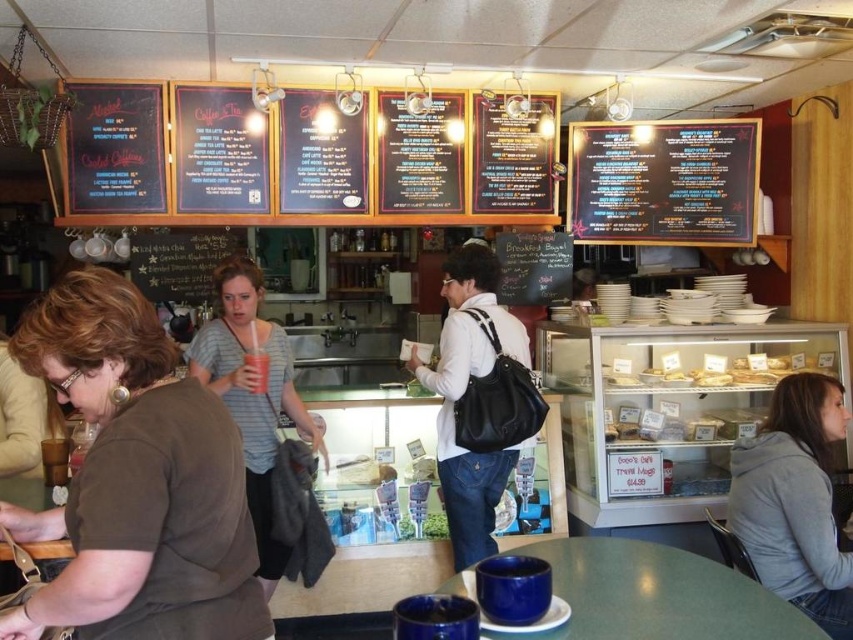
Question: Which point is farther to the camera?

Choices:
 (A) (190, 419)
 (B) (828, 586)

Answer: (B)

Question: Which is nearer to the black leather backpack at center?

Choices:
 (A) brown matte shirt at lower left
 (B) striped cotton shirt at center
 (C) gray fleece jacket at lower right
 (D) black chalkboard menu at upper right

Answer: (B)

Question: Is black leather backpack at center bigger than black chalkboard menu at upper right?

Choices:
 (A) no
 (B) yes

Answer: (B)

Question: Which of the following is the farthest from the observer?

Choices:
 (A) black chalkboard menu at upper right
 (B) black leather backpack at center
 (C) brown matte shirt at lower left

Answer: (A)

Question: Does black chalkboard menu at upper right have a larger size compared to striped cotton shirt at center?

Choices:
 (A) yes
 (B) no

Answer: (B)

Question: Is the position of black leather backpack at center less distant than that of black chalkboard menu at upper right?

Choices:
 (A) no
 (B) yes

Answer: (B)